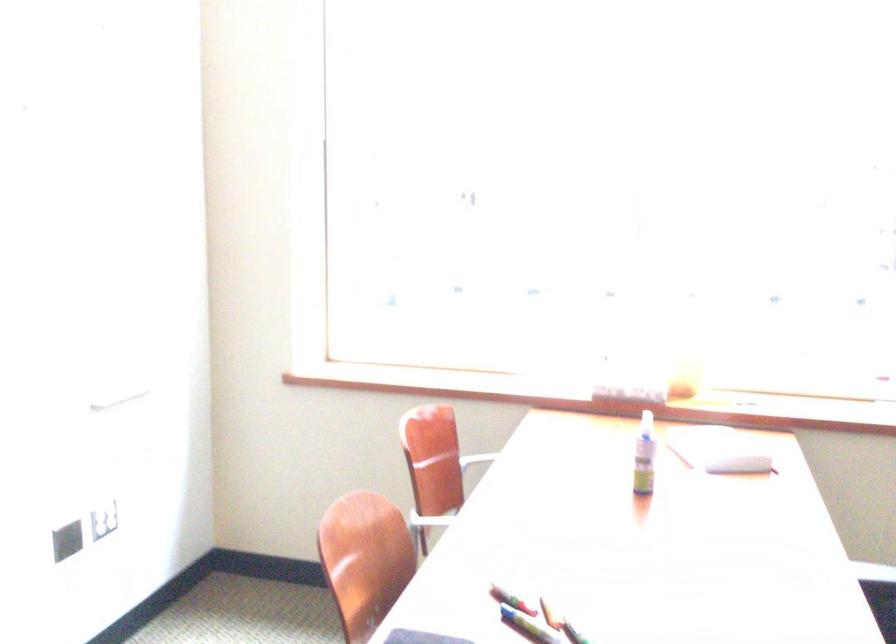
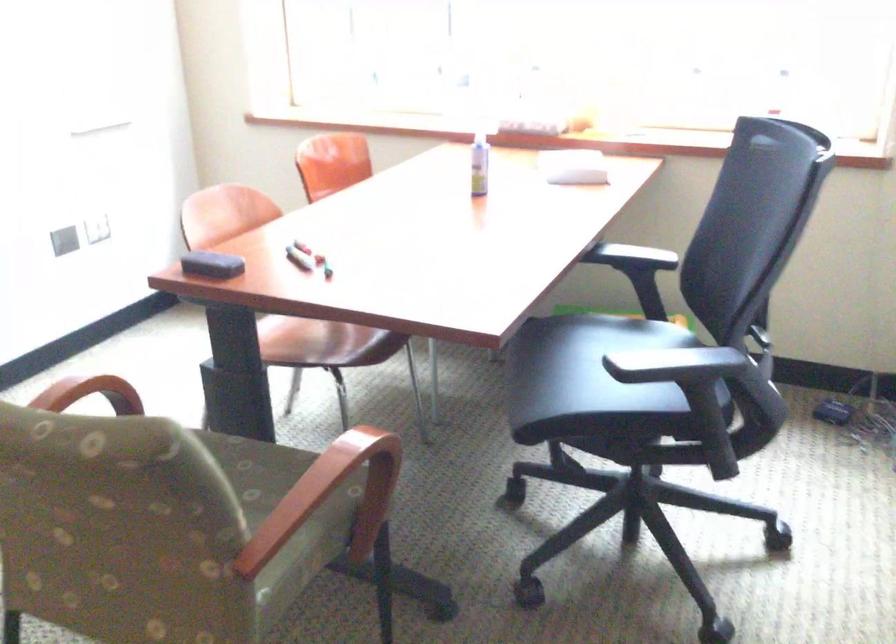
Locate, in the second image, the point that corresponds to the point at 635,451 in the first image.

(478, 164)